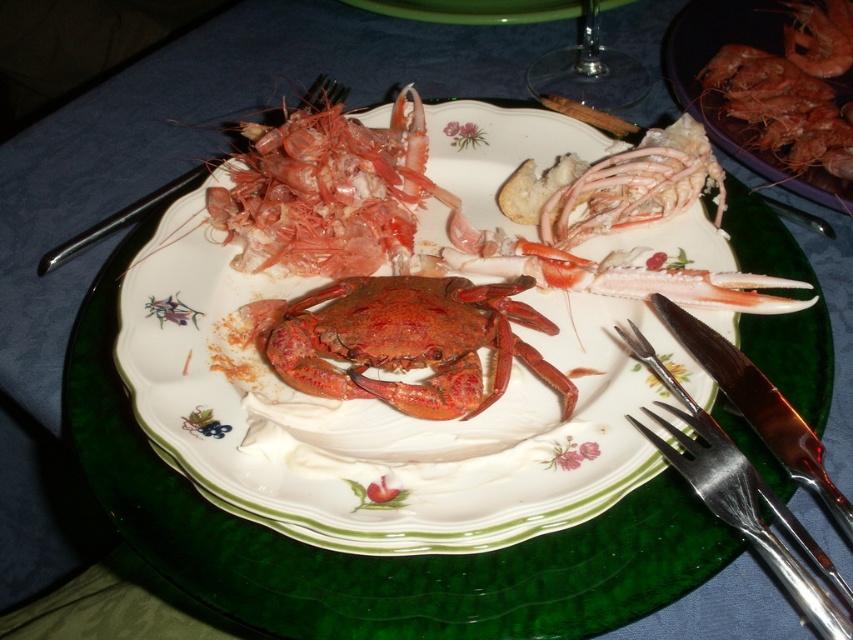
Question: Is shiny red crab at center below metallic silver fork at upper left?

Choices:
 (A) no
 (B) yes

Answer: (B)

Question: Does silver metallic fork at lower right have a larger size compared to green glass plate at upper center?

Choices:
 (A) no
 (B) yes

Answer: (B)

Question: Which object is farther from the camera taking this photo?

Choices:
 (A) transparent glass wine glass at upper center
 (B) silver metallic fork at lower right

Answer: (A)

Question: Is transparent glass wine glass at upper center wider than shiny pink shrimp at upper right?

Choices:
 (A) no
 (B) yes

Answer: (B)

Question: Which of the following is the closest to the observer?

Choices:
 (A) shiny red crab at center
 (B) silver metallic fork at lower right

Answer: (B)

Question: Which of the following is the closest to the observer?

Choices:
 (A) smooth purple plate at upper right
 (B) silver metallic fork at lower right

Answer: (B)